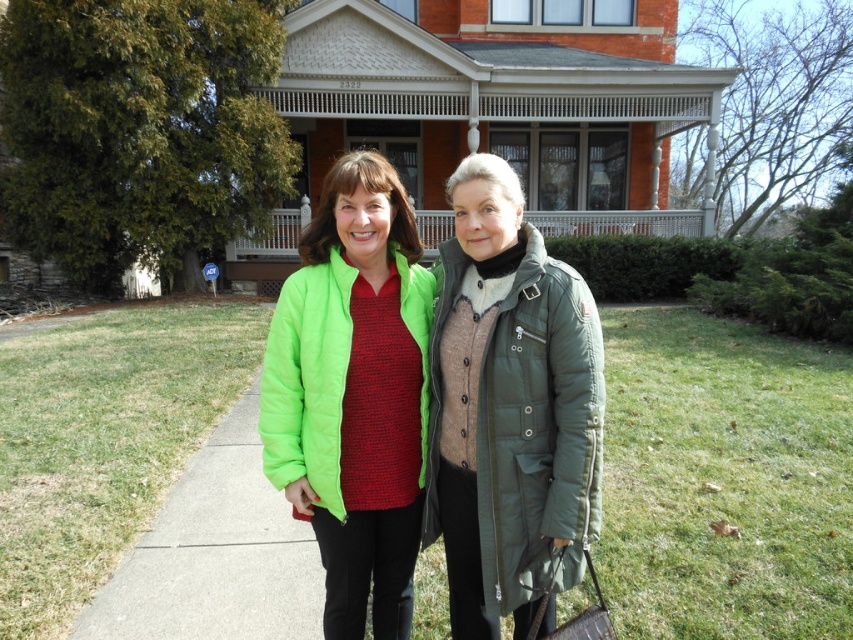
Question: Is green quilted jacket at center wider than green matte pavement at lower left?

Choices:
 (A) no
 (B) yes

Answer: (A)

Question: Can you confirm if matte green puffer jacket at center is thinner than green matte pavement at lower left?

Choices:
 (A) no
 (B) yes

Answer: (B)

Question: Considering the real-world distances, which object is closest to the green matte pavement at lower left?

Choices:
 (A) green quilted jacket at center
 (B) matte green puffer jacket at center

Answer: (B)

Question: Which of the following is the farthest from the observer?

Choices:
 (A) (323, 566)
 (B) (161, 628)
 (C) (514, 275)

Answer: (B)

Question: Which point appears farthest from the camera in this image?

Choices:
 (A) click(323, 298)
 (B) click(486, 248)
 (C) click(253, 548)

Answer: (C)

Question: Is matte green puffer jacket at center to the left of green matte pavement at lower left from the viewer's perspective?

Choices:
 (A) yes
 (B) no

Answer: (B)